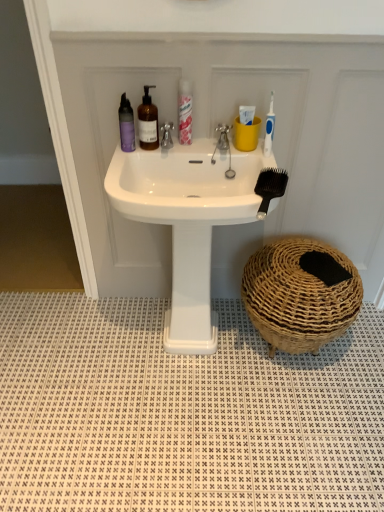
Where is `free space above white textured tile at lower center (from a real-world perspective)`? This screenshot has height=512, width=384. free space above white textured tile at lower center (from a real-world perspective) is located at coordinates (163, 385).